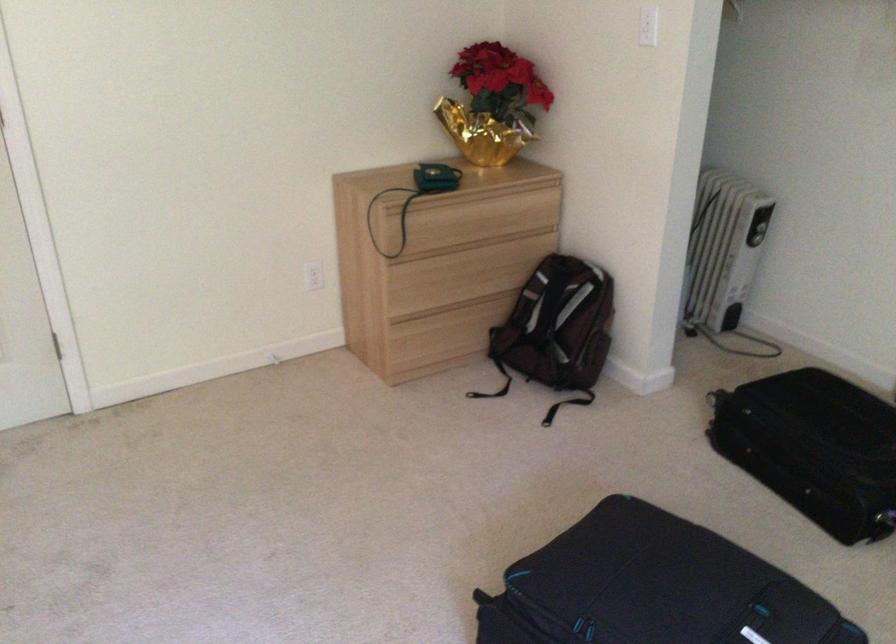
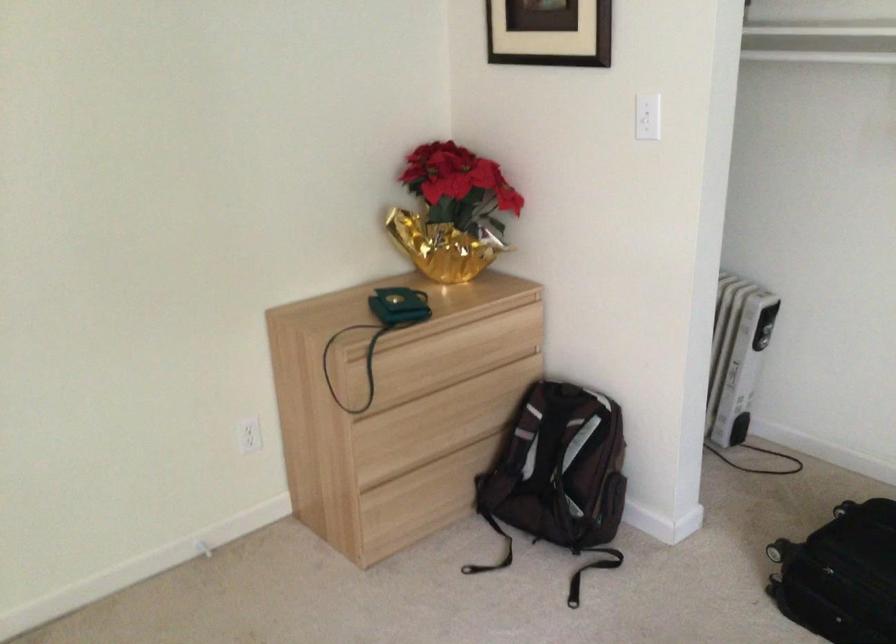
Find the pixel in the second image that matches point 453,353 in the first image.

(435, 516)